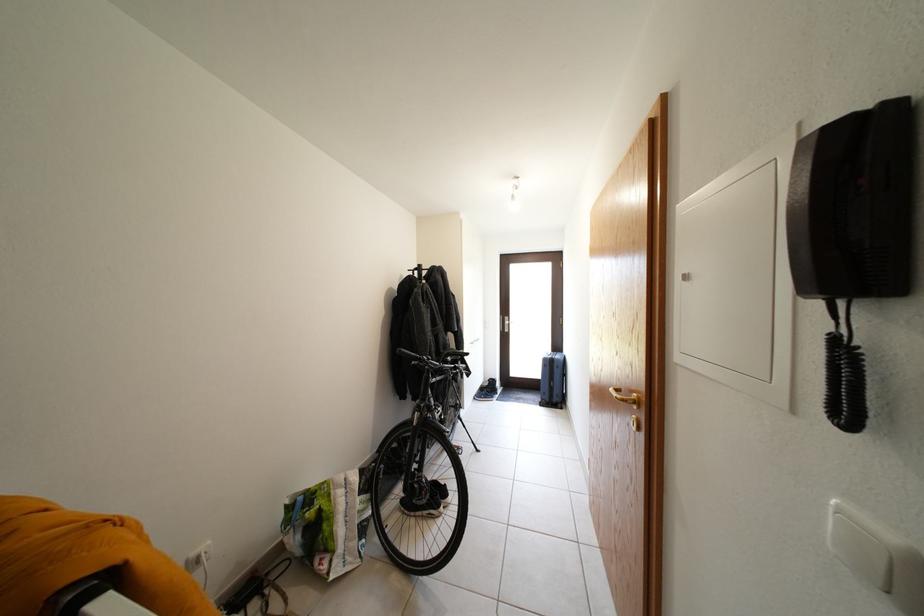
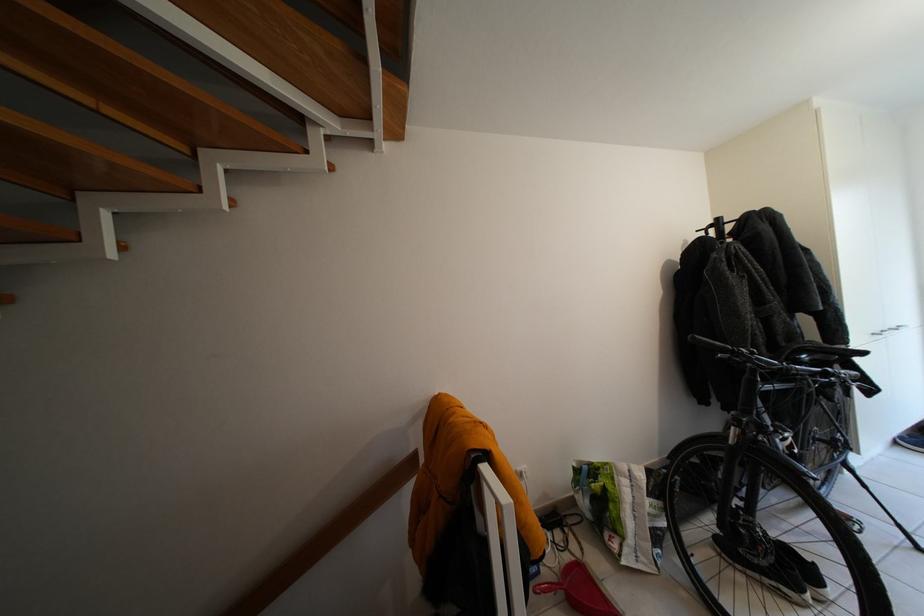
In the second image, find the point that corresponds to point (468, 362) in the first image.

(846, 361)